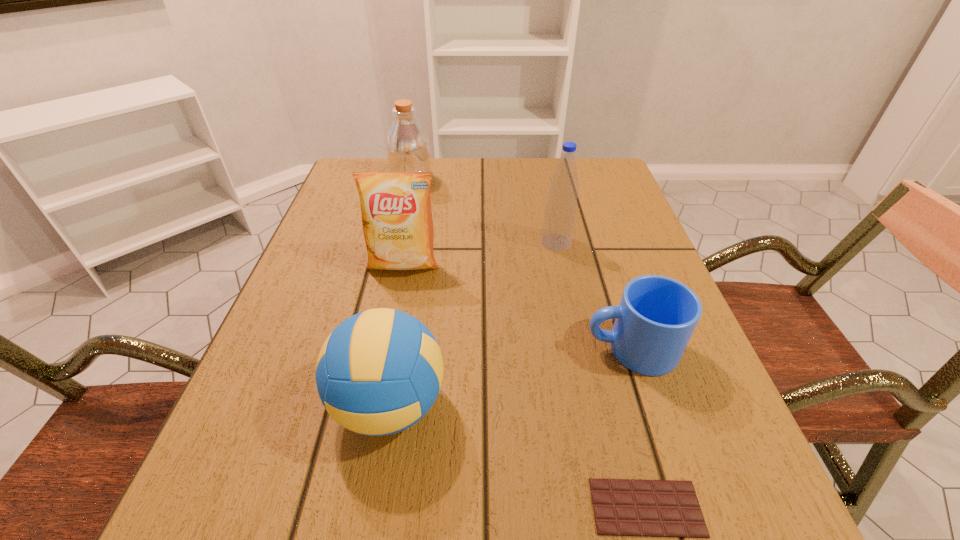
Where is `water bottle`? Image resolution: width=960 pixels, height=540 pixels. water bottle is located at coordinates (560, 211).

Identify the location of the farthest object. (408, 150).

Where is `crisp (potato chip)`? The height and width of the screenshot is (540, 960). crisp (potato chip) is located at coordinates (397, 222).

The image size is (960, 540). In order to click on volleyball in this screenshot , I will do `click(379, 372)`.

This screenshot has height=540, width=960. In order to click on mug in this screenshot , I will do `click(657, 315)`.

Find the location of `the nearest object`. the nearest object is located at coordinates (622, 507).

I want to click on the shortest object, so click(x=622, y=507).

This screenshot has width=960, height=540. In order to click on vacant space located 0.290m on the back of the water bottle in this screenshot , I will do click(541, 170).

I want to click on free space located 0.280m on the right of the bottle, so click(538, 180).

Locate an element on the screen. The height and width of the screenshot is (540, 960). free space located on the front-facing side of the crisp (potato chip) is located at coordinates (381, 375).